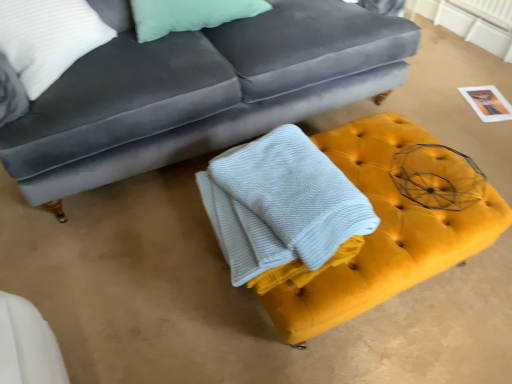
At what (x,y) coordinates should I click in order to perform the action: click on vacant space that is to the left of yellow velvet ottoman at center. Please return your answer as a coordinate pair (x, y). The height and width of the screenshot is (384, 512). Looking at the image, I should click on (151, 271).